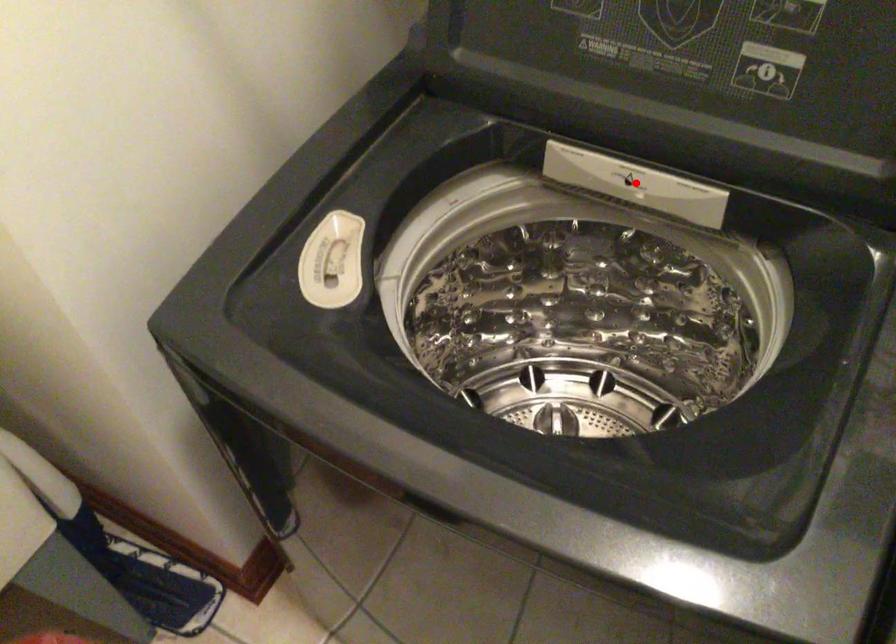
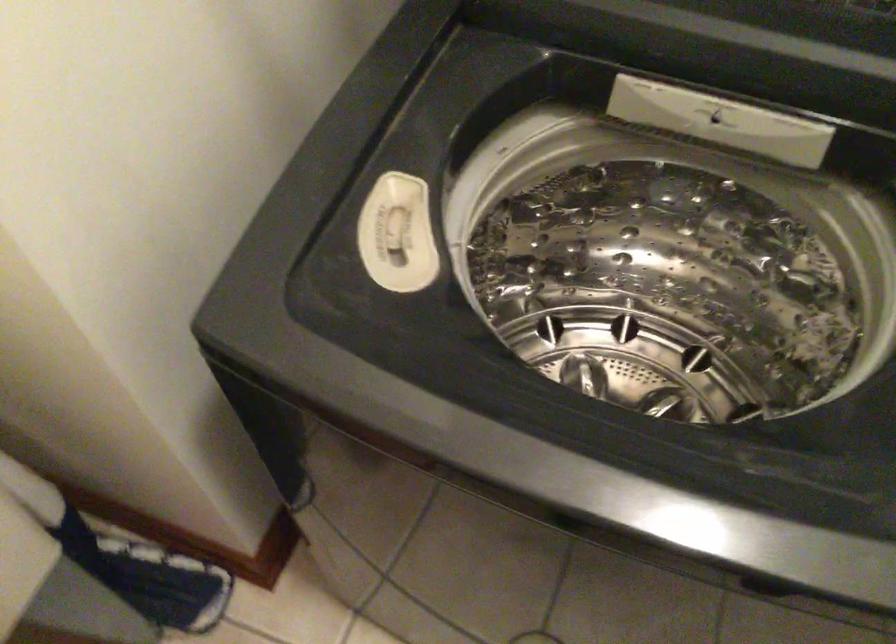
Question: I am providing you with two images of the same scene from different viewpoints. Image1 has a red point marked. In image2, the corresponding 3D location appears at what relative position? Reply with the corresponding letter.

Choices:
 (A) Closer
 (B) Farther

Answer: (A)